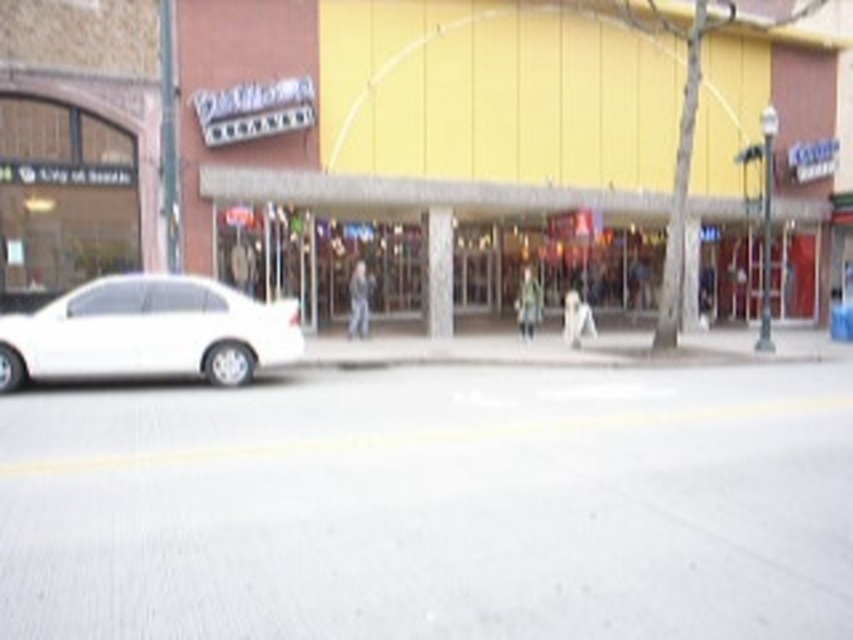
You are standing at the entrance of the building and want to go to the yellow matte mall at center. In which direction should you walk relative to the building?

The yellow matte mall at center is located at point (427, 147), so you should walk towards the center of the image from the entrance.

You are a delivery person trying to park your vehicle in the area shown. You see the yellow matte mall at center and the matte glass storefront at center. Which one is located higher up in the image?

The yellow matte mall at center is positioned over the matte glass storefront at center, so it is higher up in the image.